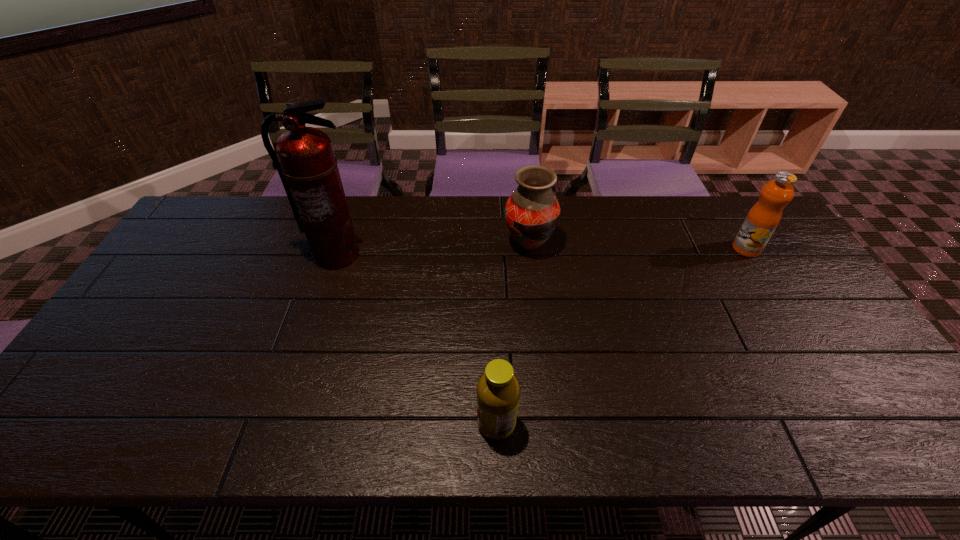
What are the coordinates of `fire extinguisher` in the screenshot? It's located at (304, 157).

This screenshot has height=540, width=960. I want to click on the tallest object, so click(304, 157).

Find the location of `the farther fruit juice`. the farther fruit juice is located at coordinates (761, 221).

In order to click on the taller fruit juice in this screenshot , I will do `click(761, 221)`.

Identify the location of vase. This screenshot has height=540, width=960. (532, 212).

Find the location of a particular element. The height and width of the screenshot is (540, 960). the left fruit juice is located at coordinates (498, 391).

Locate an element on the screen. Image resolution: width=960 pixels, height=540 pixels. the shortest object is located at coordinates (498, 391).

The image size is (960, 540). I want to click on free space located 0.130m on the nozzle side of the tallest object, so click(320, 303).

You are a GUI agent. You are given a task and a screenshot of the screen. Output one action in this format:
    pyautogui.click(x=<x>, y=<y>)
    Task: Click on the vacant point located 0.340m on the front of the farther fruit juice
    The width and height of the screenshot is (960, 540).
    Given the screenshot: What is the action you would take?
    pyautogui.click(x=808, y=349)

Find the location of a particular element. The height and width of the screenshot is (540, 960). vacant space located on the right of the vase is located at coordinates (667, 244).